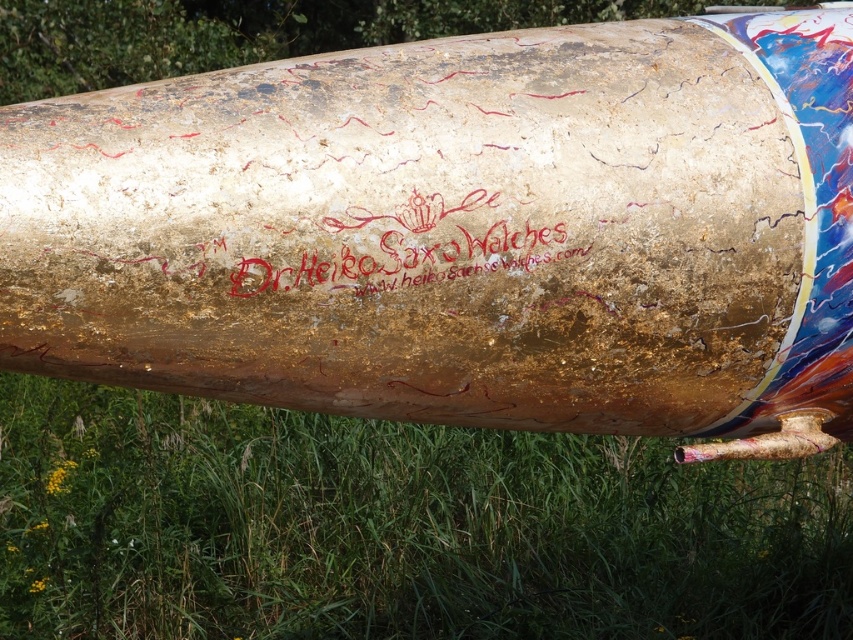
Question: Which point is closer to the camera?

Choices:
 (A) coord(285,486)
 (B) coord(762,36)

Answer: (B)

Question: Which point is farther to the camera?

Choices:
 (A) gold metallic barrel at center
 (B) green grass at lower center

Answer: (B)

Question: Is gold metallic barrel at center below green grass at lower center?

Choices:
 (A) yes
 (B) no

Answer: (B)

Question: Which object appears closest to the camera in this image?

Choices:
 (A) green grass at lower center
 (B) gold metallic barrel at center

Answer: (B)

Question: Can you confirm if gold metallic barrel at center is bigger than green grass at lower center?

Choices:
 (A) no
 (B) yes

Answer: (A)

Question: Is gold metallic barrel at center bigger than green grass at lower center?

Choices:
 (A) no
 (B) yes

Answer: (A)